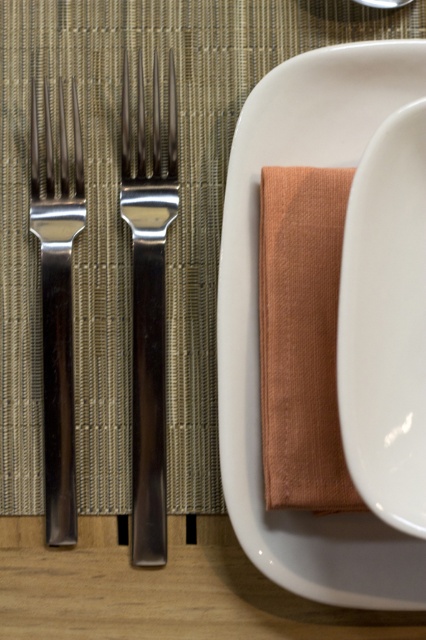
You are setting up a table for a formal dinner and need to place a decorative centerpiece. The centerpiece requires a surface that is taller than the polished silver fork at left. Can the white matte platter at center provide a suitable surface for this centerpiece?

The white matte platter at center is much taller than the polished silver fork at left, so it can provide a suitable surface for the decorative centerpiece.

You are setting up a dinner table and need to place a decorative centerpiece between the polished silver fork at left and the white matte platter at center. Based on their current positions, where should you place the centerpiece to ensure it is between them?

The white matte platter at center is positioned on the right side of the polished silver fork at left, so the centerpiece should be placed between the polished silver fork at left and the white matte platter at center, closer to the middle of the table where they are aligned.

You are a server arranging cutlery on a table. You have two polished silver forks to place. The polished silver fork at center and the polished silver fork at left. According to the image, which fork should you place closer to the customer so they can reach it easily?

The polished silver fork at center is closer to the customer because it is further to the viewer than the polished silver fork at left, making it more accessible.